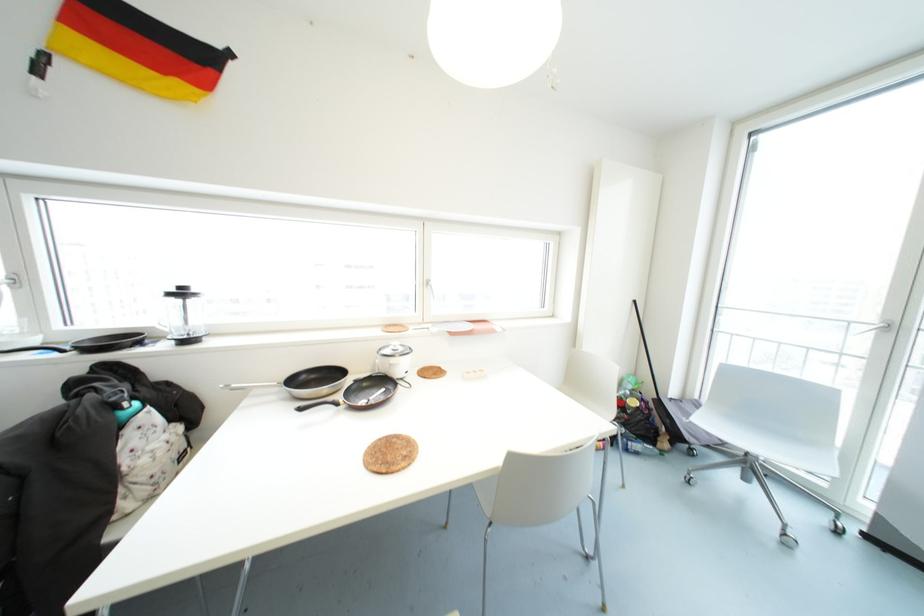
What do you see at coordinates (249, 386) in the screenshot?
I see `a silver pan handle` at bounding box center [249, 386].